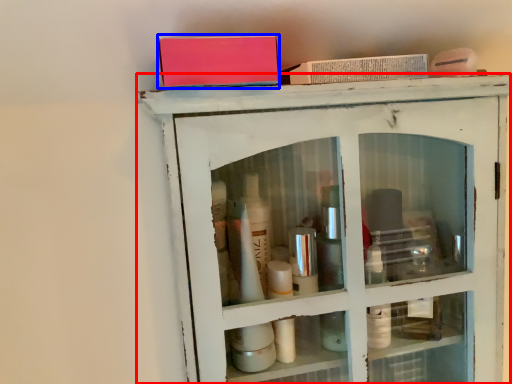
Question: Which object is further to the camera taking this photo, shelf (highlighted by a red box) or book (highlighted by a blue box)?

Choices:
 (A) shelf
 (B) book

Answer: (A)